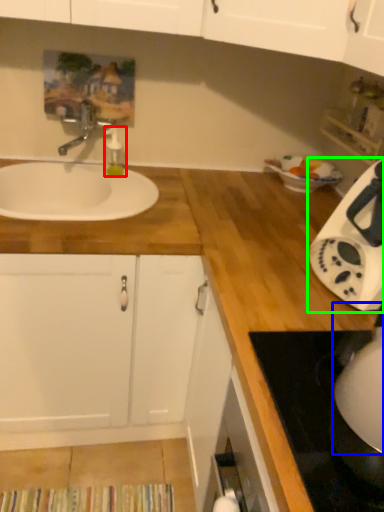
Question: Considering the real-world distances, which object is farthest from soap dispenser (highlighted by a red box)? appliance (highlighted by a blue box) or home appliance (highlighted by a green box)?

Choices:
 (A) appliance
 (B) home appliance

Answer: (A)